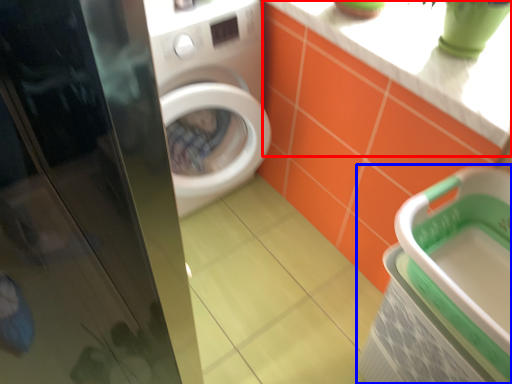
Question: Which object is closer to the camera taking this photo, counter top (highlighted by a red box) or dish washer (highlighted by a blue box)?

Choices:
 (A) counter top
 (B) dish washer

Answer: (B)